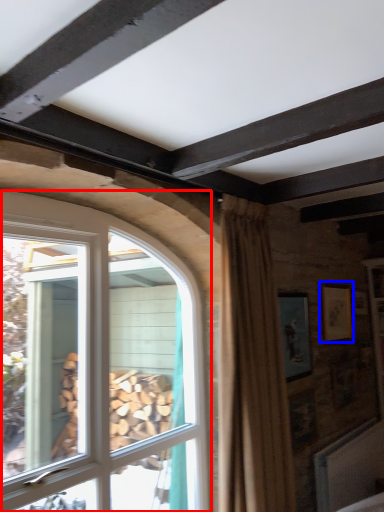
Question: Among these objects, which one is farthest to the camera, window (highlighted by a red box) or picture frame (highlighted by a blue box)?

Choices:
 (A) window
 (B) picture frame

Answer: (B)